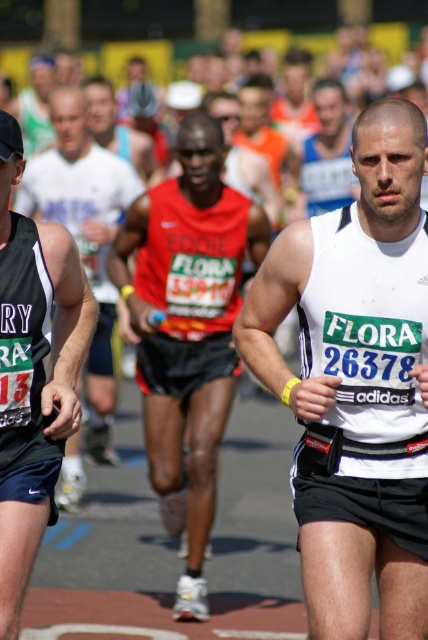
You are a photographer at the marathon event. You want to capture a photo of both the white matte singlet at center and the red fabric shirt at center in the same frame. The camera has a minimum focus distance of 2 meters. Can you take the photo with both runners in focus?

The white matte singlet at center and red fabric shirt at center are 2.67 meters apart from each other. Since the distance between them is greater than the camera minimum focus distance of 2 meters, the photographer can take the photo with both runners in focus.

You are a photographer at the marathon event. You want to capture a photo of the two runners wearing red fabric shirt at center and red mesh tank top at center. Which runner should you focus on to get a larger subject in your photo?

The red mesh tank top at center is larger than the red fabric shirt at center, so focusing on the red mesh tank top at center will result in a larger subject in the photo.

You are a photographer at the marathon event and want to capture a closeup of the white matte singlet at center and the red mesh tank top at center. Which runner should you focus on first to ensure the closest subject is in focus?

The white matte singlet at center is closer to the viewer than the red mesh tank top at center, so you should focus on the white matte singlet at center first to ensure the closest subject is in focus.